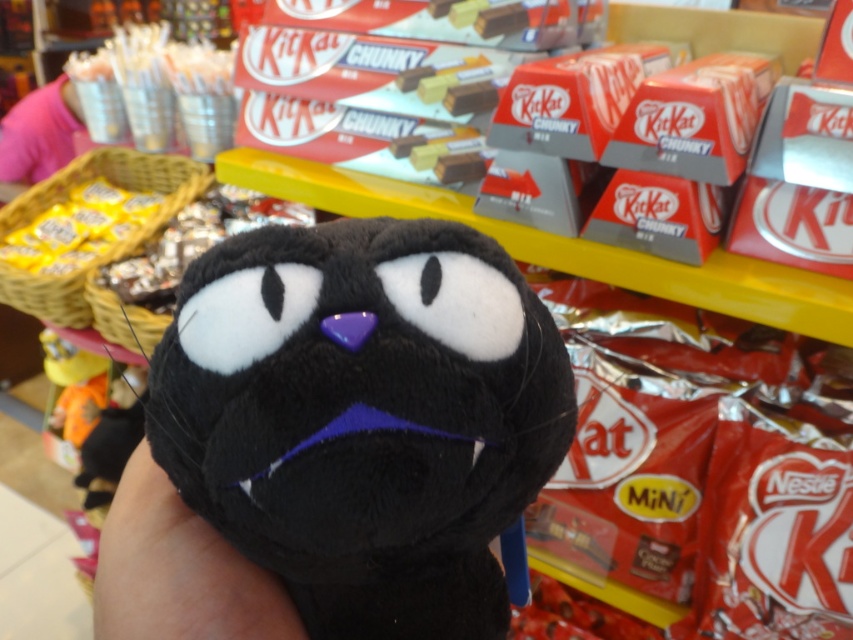
Which is in front, point (405, 362) or point (126, 490)?

Point (405, 362) is more forward.

Can you confirm if soft plush toy at center is thinner than soft skin at center?

No, soft plush toy at center is not thinner than soft skin at center.

Is point (440, 320) farther from viewer compared to point (213, 561)?

No, (440, 320) is closer to viewer.

Locate an element on the screen. The height and width of the screenshot is (640, 853). soft plush toy at center is located at coordinates (363, 417).

Is point (258, 534) closer to camera compared to point (38, 108)?

Yes, point (258, 534) is closer to viewer.

Can you confirm if soft plush toy at center is wider than pink fabric shirt at upper left?

Incorrect, soft plush toy at center's width does not surpass pink fabric shirt at upper left's.

The height and width of the screenshot is (640, 853). What are the coordinates of `soft plush toy at center` in the screenshot? It's located at (363, 417).

Does soft skin at center appear on the left side of pink fabric shirt at upper left?

No, soft skin at center is not to the left of pink fabric shirt at upper left.

Does soft skin at center have a larger size compared to pink fabric shirt at upper left?

A: Incorrect, soft skin at center is not larger than pink fabric shirt at upper left.

Where is `soft skin at center`? Image resolution: width=853 pixels, height=640 pixels. soft skin at center is located at coordinates (178, 570).